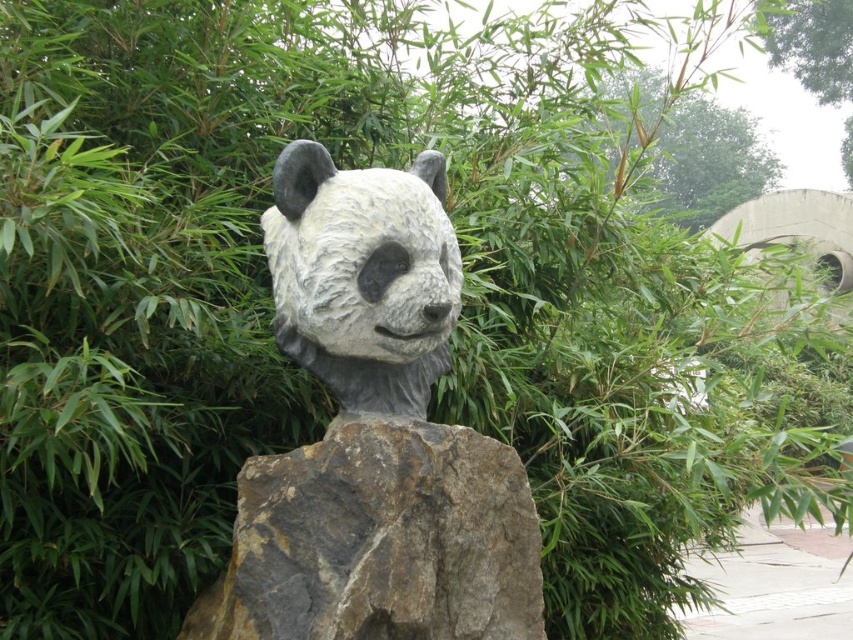
You are a gardener who wants to place a new small bush between the white stone panda head at center and the nearest bamboo plant. Can you do this without the bush overlapping either of them?

The distance between the white stone panda head at center and the nearest bamboo plant is 1.57 meters. Since the bush is small, it can be placed in between them without overlapping either.

You are standing in front of a statue of a panda head. The statue is located at the center of the image. If you want to take a photo of the white stone panda head at center from the front, where should you position yourself relative to the statue?

You should position yourself directly in front of the white stone panda head at center to capture it from the front.